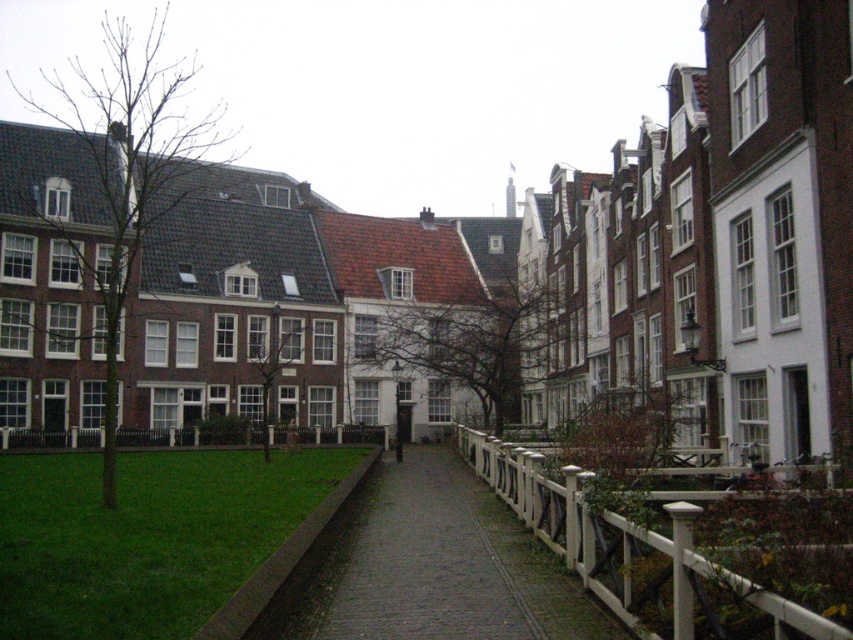
Is point (131, 628) positioned before point (662, 568)?

Yes, point (131, 628) is in front of point (662, 568).

Find the location of a particular element. Image resolution: width=853 pixels, height=640 pixels. green grass at lower left is located at coordinates (144, 536).